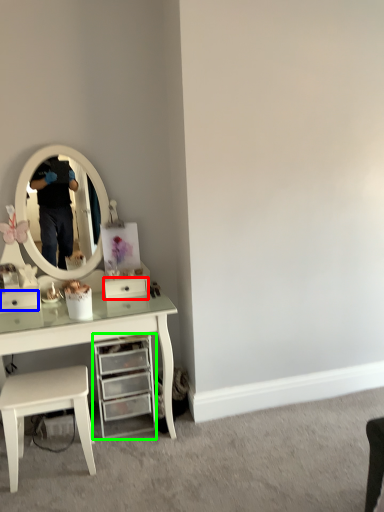
Question: Based on their relative distances, which object is farther from drawer (highlighted by a red box)? Choose from drawer (highlighted by a blue box) and chest of drawers (highlighted by a green box).

Choices:
 (A) drawer
 (B) chest of drawers

Answer: (A)